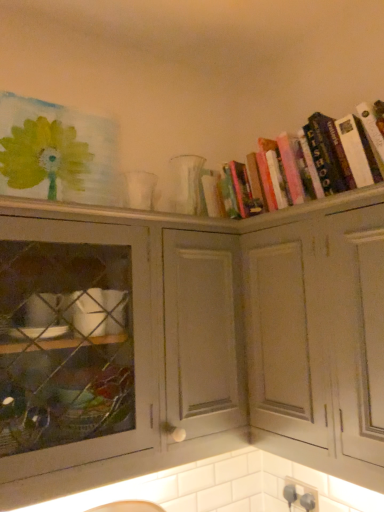
Question: From the image's perspective, is matte gray cabinet at center, which ranks as the first cabinetry in left-to-right order, on hardcover books at upper right?

Choices:
 (A) yes
 (B) no

Answer: (B)

Question: Is matte gray cabinet at center, which ranks as the first cabinetry in left-to-right order, with hardcover books at upper right?

Choices:
 (A) no
 (B) yes

Answer: (A)

Question: Can you confirm if matte gray cabinet at center, which ranks as the second cabinetry in right-to-left order, is wider than hardcover books at upper right?

Choices:
 (A) no
 (B) yes

Answer: (B)

Question: Is matte gray cabinet at center, which ranks as the second cabinetry in right-to-left order, shorter than hardcover books at upper right?

Choices:
 (A) yes
 (B) no

Answer: (B)

Question: Is matte gray cabinet at center, which ranks as the second cabinetry in right-to-left order, turned away from hardcover books at upper right?

Choices:
 (A) yes
 (B) no

Answer: (B)

Question: Does matte gray cabinet at center, which ranks as the first cabinetry in left-to-right order, have a greater height compared to hardcover books at upper right?

Choices:
 (A) no
 (B) yes

Answer: (B)

Question: Is hardcover books at upper right positioned before white matte cabinet at upper right, the first cabinetry from the right?

Choices:
 (A) yes
 (B) no

Answer: (B)

Question: From the image's perspective, is hardcover books at upper right on white matte cabinet at upper right, which is counted as the 2th cabinetry, starting from the left?

Choices:
 (A) no
 (B) yes

Answer: (B)

Question: From the image's perspective, is hardcover books at upper right beneath white matte cabinet at upper right, which is counted as the 2th cabinetry, starting from the left?

Choices:
 (A) yes
 (B) no

Answer: (B)

Question: Can you confirm if hardcover books at upper right is positioned to the right of white matte cabinet at upper right, the first cabinetry from the right?

Choices:
 (A) yes
 (B) no

Answer: (A)

Question: Is hardcover books at upper right shorter than white matte cabinet at upper right, the first cabinetry from the right?

Choices:
 (A) no
 (B) yes

Answer: (B)

Question: Does hardcover books at upper right have a smaller size compared to white matte cabinet at upper right, the first cabinetry from the right?

Choices:
 (A) yes
 (B) no

Answer: (A)

Question: Is hardcover books at upper right facing away from matte gray cabinet at center, which ranks as the first cabinetry in left-to-right order?

Choices:
 (A) yes
 (B) no

Answer: (B)